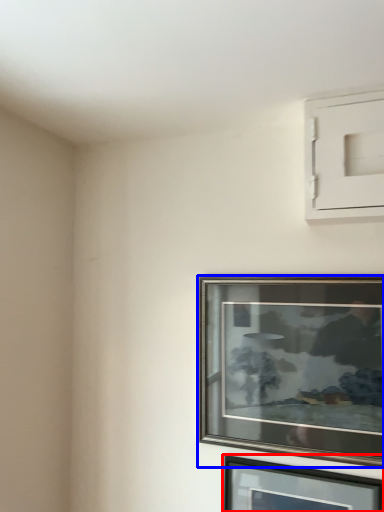
Question: Among these objects, which one is nearest to the camera, picture frame (highlighted by a red box) or picture frame (highlighted by a blue box)?

Choices:
 (A) picture frame
 (B) picture frame

Answer: (A)